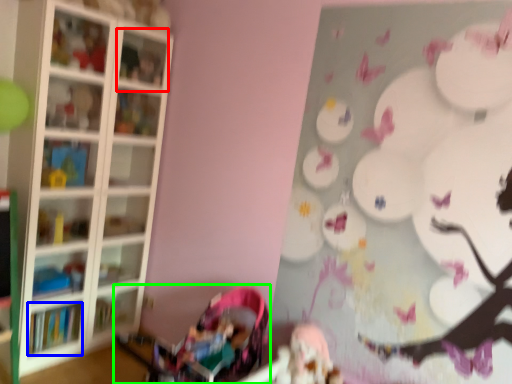
Question: Considering the real-world distances, which object is farthest from cabinet (highlighted by a red box)? book (highlighted by a blue box) or baby carriage (highlighted by a green box)?

Choices:
 (A) book
 (B) baby carriage

Answer: (A)